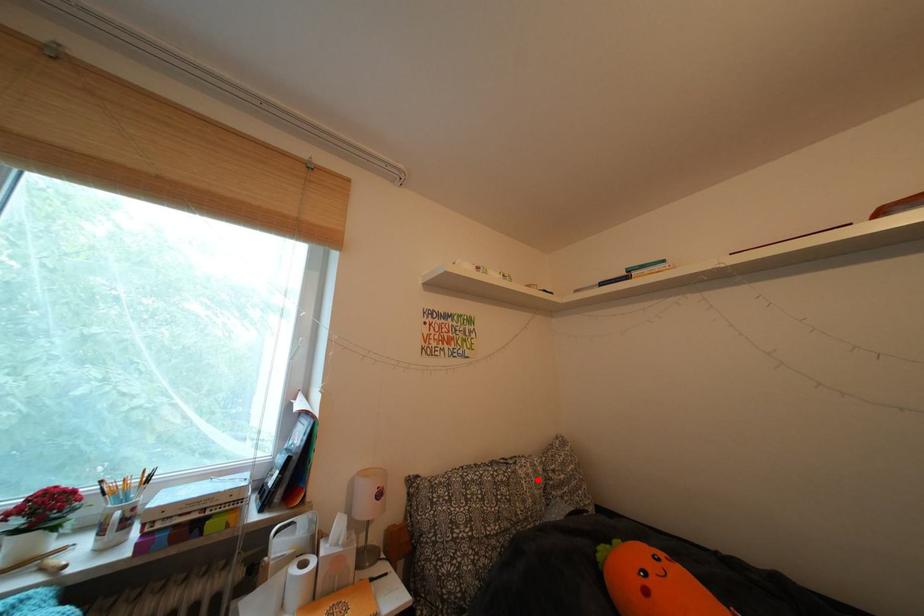
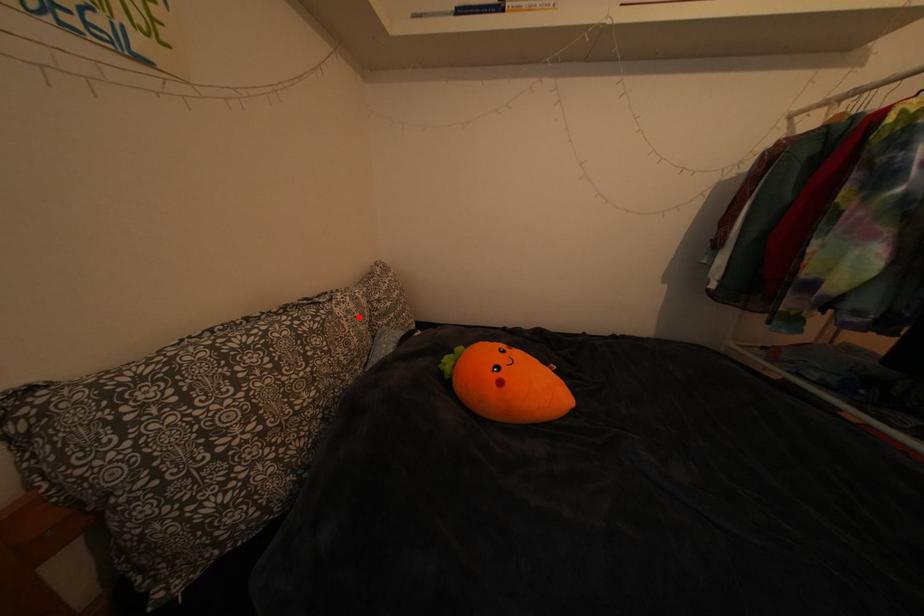
I am providing you with two images of the same scene from different viewpoints. A red point is marked on the first image and another point is marked on the second image. Do the highlighted points in image1 and image2 indicate the same real-world spot?

Yes